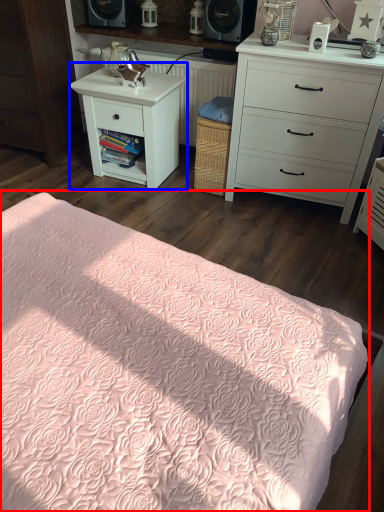
Question: Which point is closer to the camera, bed (highlighted by a red box) or nightstand (highlighted by a blue box)?

Choices:
 (A) bed
 (B) nightstand

Answer: (A)